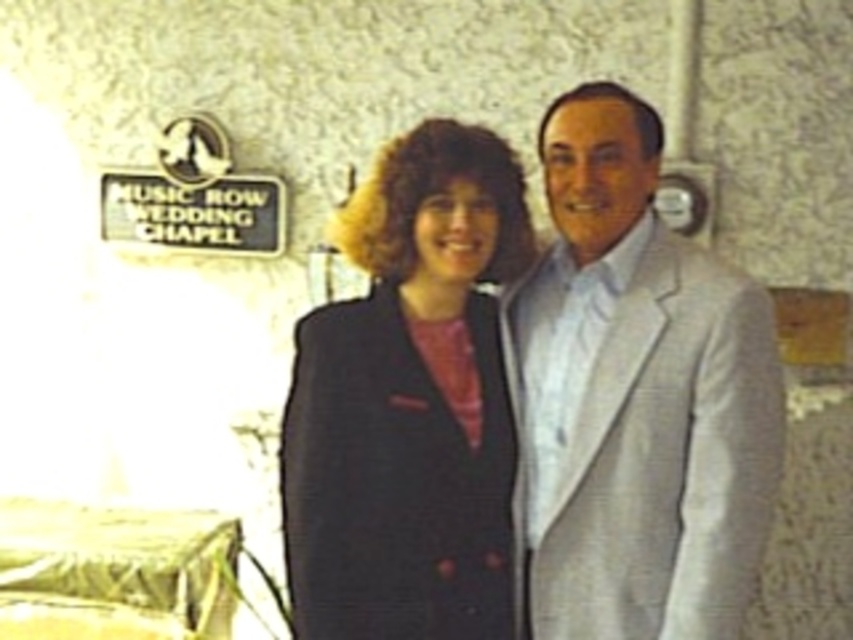
Question: Is light gray textured suit at center bigger than matte black blazer at center?

Choices:
 (A) no
 (B) yes

Answer: (B)

Question: Which object is farther from the camera taking this photo?

Choices:
 (A) matte black blazer at center
 (B) light gray textured suit at center

Answer: (A)

Question: Can you confirm if light gray textured suit at center is thinner than matte black blazer at center?

Choices:
 (A) yes
 (B) no

Answer: (A)

Question: Can you confirm if light gray textured suit at center is bigger than matte black blazer at center?

Choices:
 (A) no
 (B) yes

Answer: (B)